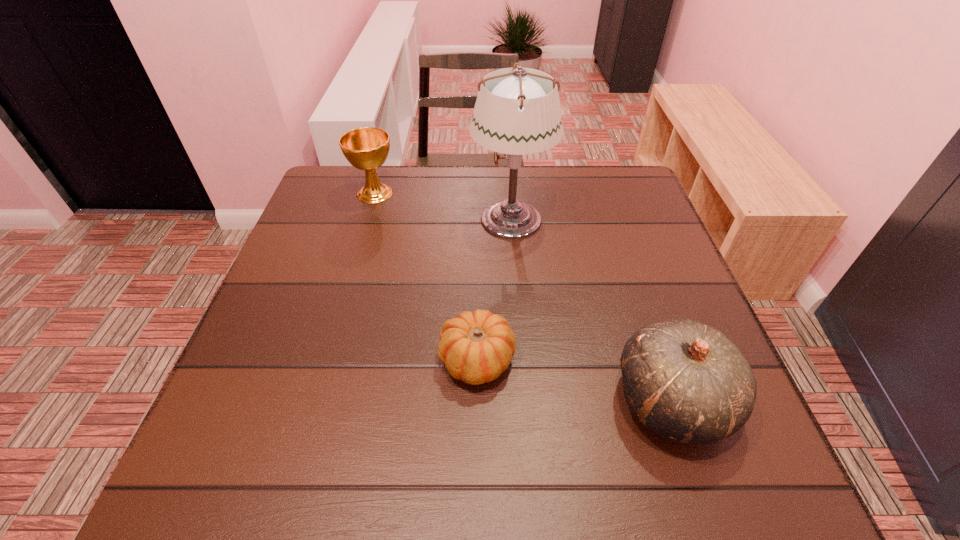
Identify the location of free space at the near edge of the desktop. This screenshot has width=960, height=540. (540, 482).

Image resolution: width=960 pixels, height=540 pixels. In the image, there is a desktop. Identify the location of blank space at the right edge. (676, 258).

The width and height of the screenshot is (960, 540). I want to click on vacant space at the far left corner of the desktop, so click(329, 190).

In the image, there is a desktop. Where is `free space at the far right corner`? The image size is (960, 540). free space at the far right corner is located at coordinates (635, 184).

This screenshot has height=540, width=960. What are the coordinates of `free spot between the lampshade and the leftmost object` in the screenshot? It's located at (443, 206).

Find the location of a particular element. Image resolution: width=960 pixels, height=540 pixels. unoccupied area between the leftmost object and the rightmost object is located at coordinates (523, 296).

I want to click on empty location between the leftmost object and the right gourd, so click(523, 296).

Identify the location of vacant point located between the taller gourd and the lampshade. coord(591,309).

Locate an element on the screen. free space that is in between the leftmost object and the lampshade is located at coordinates (443, 206).

This screenshot has width=960, height=540. What are the coordinates of `free point between the left gourd and the tallest object` in the screenshot? It's located at (493, 289).